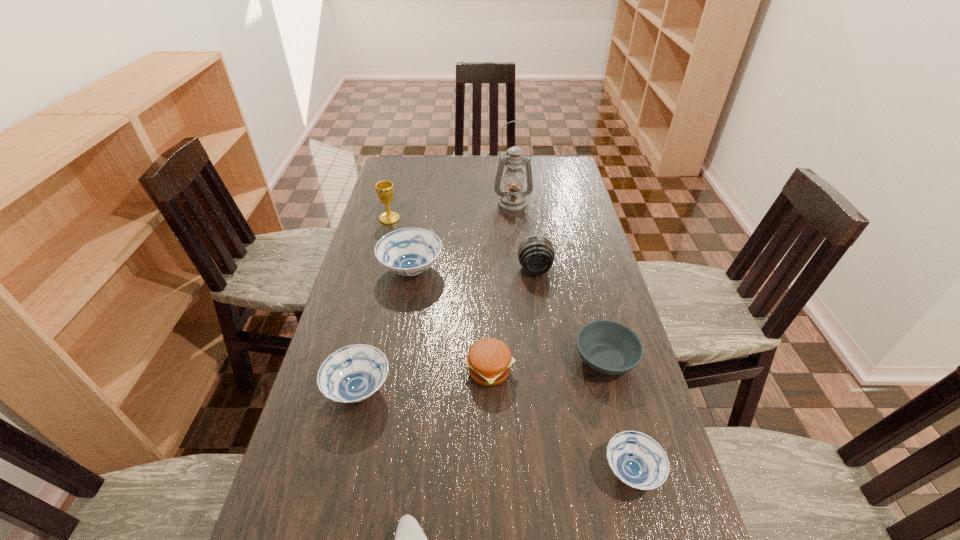
I want to click on the tallest object, so click(x=513, y=199).

Image resolution: width=960 pixels, height=540 pixels. Find the location of `the farthest object`. the farthest object is located at coordinates (513, 199).

This screenshot has height=540, width=960. I want to click on gold chalice, so [385, 189].

What are the coordinates of `the second tallest object` in the screenshot? It's located at pos(385,189).

Locate an element on the screen. This screenshot has width=960, height=540. telephoto lens is located at coordinates point(536,253).

Locate an element on the screen. the farthest blue soup bowl is located at coordinates (410, 251).

This screenshot has width=960, height=540. Find the location of `the farthest soup bowl`. the farthest soup bowl is located at coordinates (410, 251).

This screenshot has height=540, width=960. In order to click on hamburger in this screenshot , I will do `click(489, 360)`.

Where is `the second smallest blue soup bowl`? The width and height of the screenshot is (960, 540). the second smallest blue soup bowl is located at coordinates (352, 374).

You are a GUI agent. You are given a task and a screenshot of the screen. Output one action in this format:
    pyautogui.click(x=<x>, y=<y>)
    Task: Click on the second farthest blue soup bowl
    The image size is (960, 540).
    Given the screenshot: What is the action you would take?
    pyautogui.click(x=352, y=374)